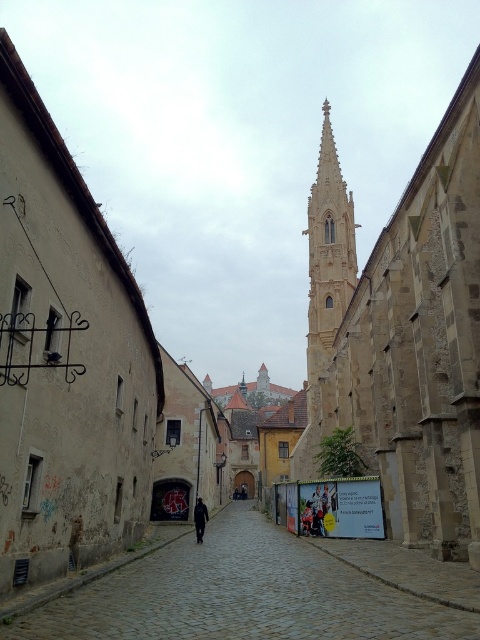
Does yellow stone church at center appear on the right side of black matte jacket at center?

Indeed, yellow stone church at center is positioned on the right side of black matte jacket at center.

Is yellow stone church at center to the left of black matte jacket at center from the viewer's perspective?

No, yellow stone church at center is not to the left of black matte jacket at center.

Locate an element on the screen. yellow stone church at center is located at coordinates (404, 333).

Is point (146, 403) positioned before point (474, 152)?

No, (146, 403) is further to viewer.

Between point (69, 422) and point (419, 442), which one is positioned in front?

Point (69, 422)

Where is `stone church at left`? stone church at left is located at coordinates coord(64,356).

Is cobblestone alley at center shorter than black matte jacket at center?

No.

Can you confirm if cobblestone alley at center is thinner than black matte jacket at center?

In fact, cobblestone alley at center might be wider than black matte jacket at center.

The height and width of the screenshot is (640, 480). I want to click on cobblestone alley at center, so click(x=241, y=595).